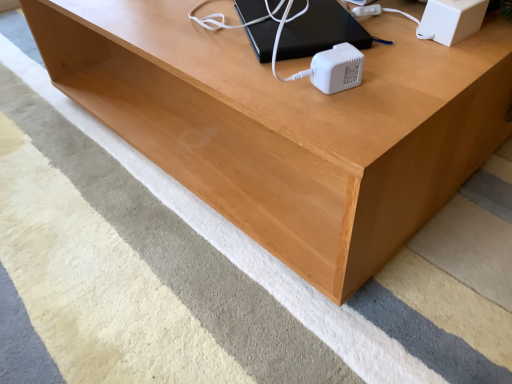
The height and width of the screenshot is (384, 512). What do you see at coordinates (321, 31) in the screenshot?
I see `black plastic computer at upper center` at bounding box center [321, 31].

You are a GUI agent. You are given a task and a screenshot of the screen. Output one action in this format:
    pyautogui.click(x=<x>, y=<y>)
    Task: Click on the black plastic computer at upper center
    The height and width of the screenshot is (384, 512).
    Given the screenshot: What is the action you would take?
    pyautogui.click(x=321, y=31)

Identify the location of white plastic speaker at upper right. (451, 20).

This screenshot has width=512, height=384. Describe the element at coordinates (451, 20) in the screenshot. I see `white plastic speaker at upper right` at that location.

Locate an element on the screen. black plastic computer at upper center is located at coordinates (321, 31).

Between black plastic computer at upper center and white plastic speaker at upper right, which one appears on the right side from the viewer's perspective?

Positioned to the right is white plastic speaker at upper right.

Between black plastic computer at upper center and white plastic speaker at upper right, which one is positioned behind?

black plastic computer at upper center is further away from the camera.

Is point (300, 42) closer or farther from the camera than point (455, 3)?

Point (300, 42) is positioned farther from the camera compared to point (455, 3).

From the image's perspective, which object appears higher, black plastic computer at upper center or white plastic speaker at upper right?

black plastic computer at upper center is shown above in the image.

From a real-world perspective, between black plastic computer at upper center and white plastic speaker at upper right, who is vertically higher?

white plastic speaker at upper right.

In the scene shown: Can you confirm if black plastic computer at upper center is wider than white plastic speaker at upper right?

Indeed, black plastic computer at upper center has a greater width compared to white plastic speaker at upper right.

Based on the photo, between black plastic computer at upper center and white plastic speaker at upper right, which one has less height?

With less height is black plastic computer at upper center.

Is black plastic computer at upper center bigger than white plastic speaker at upper right?

Yes, black plastic computer at upper center is bigger than white plastic speaker at upper right.

Is white plastic speaker at upper right located within black plastic computer at upper center?

That's incorrect, white plastic speaker at upper right is not inside black plastic computer at upper center.

Is black plastic computer at upper center not near white plastic speaker at upper right?

black plastic computer at upper center is actually quite close to white plastic speaker at upper right.

Is black plastic computer at upper center facing towards white plastic speaker at upper right?

Yes, black plastic computer at upper center is oriented towards white plastic speaker at upper right.

How different are the orientations of black plastic computer at upper center and white plastic speaker at upper right in degrees?

The facing directions of black plastic computer at upper center and white plastic speaker at upper right are 116 degrees apart.

There is a black plastic computer at upper center. Where is `speaker above it (from a real-world perspective)`? This screenshot has width=512, height=384. speaker above it (from a real-world perspective) is located at coordinates (451, 20).

Does white plastic speaker at upper right appear on the right side of black plastic computer at upper center?

Indeed, white plastic speaker at upper right is positioned on the right side of black plastic computer at upper center.

Considering their positions, is white plastic speaker at upper right located in front of or behind black plastic computer at upper center?

Visually, white plastic speaker at upper right is located in front of black plastic computer at upper center.

Is point (426, 36) closer or farther from the camera than point (362, 43)?

Point (426, 36).

From the image's perspective, which is below, white plastic speaker at upper right or black plastic computer at upper center?

white plastic speaker at upper right appears lower in the image.

From a real-world perspective, which is physically above, white plastic speaker at upper right or black plastic computer at upper center?

white plastic speaker at upper right, from a real-world perspective.

Is white plastic speaker at upper right wider or thinner than black plastic computer at upper center?

In the image, white plastic speaker at upper right appears to be more narrow than black plastic computer at upper center.

Can you confirm if white plastic speaker at upper right is taller than black plastic computer at upper center?

Indeed, white plastic speaker at upper right has a greater height compared to black plastic computer at upper center.

Considering the relative sizes of white plastic speaker at upper right and black plastic computer at upper center in the image provided, is white plastic speaker at upper right bigger than black plastic computer at upper center?

No.

Would you say white plastic speaker at upper right is outside black plastic computer at upper center?

Indeed, white plastic speaker at upper right is completely outside black plastic computer at upper center.

Is white plastic speaker at upper right placed right next to black plastic computer at upper center?

There is a gap between white plastic speaker at upper right and black plastic computer at upper center.

Is white plastic speaker at upper right positioned with its back to black plastic computer at upper center?

No, black plastic computer at upper center is not at the back of white plastic speaker at upper right.

Where is `computer on the left of white plastic speaker at upper right`? This screenshot has width=512, height=384. computer on the left of white plastic speaker at upper right is located at coordinates click(x=321, y=31).

Find the location of a particular element. computer behind the white plastic speaker at upper right is located at coordinates (321, 31).

Locate an element on the screen. This screenshot has height=384, width=512. speaker on the right of black plastic computer at upper center is located at coordinates (451, 20).